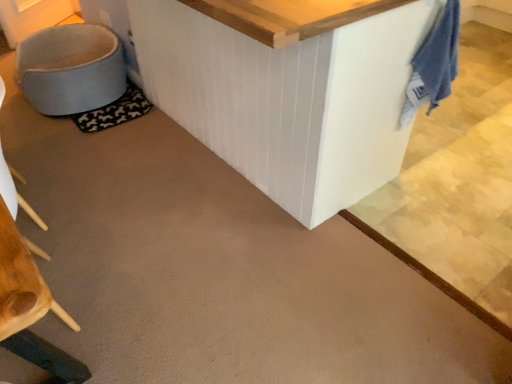
Question: From a real-world perspective, is blue cotton towel at upper right positioned above or below black fabric mat at lower left?

Choices:
 (A) below
 (B) above

Answer: (B)

Question: Considering the relative positions of blue cotton towel at upper right and black fabric mat at lower left in the image provided, is blue cotton towel at upper right to the left or to the right of black fabric mat at lower left?

Choices:
 (A) right
 (B) left

Answer: (A)

Question: Which of these objects is positioned closest to the black fabric mat at lower left?

Choices:
 (A) blue cotton towel at upper right
 (B) light blue fabric swivel chair at lower left

Answer: (B)

Question: Which object is positioned farthest from the light blue fabric swivel chair at lower left?

Choices:
 (A) blue cotton towel at upper right
 (B) black fabric mat at lower left

Answer: (A)